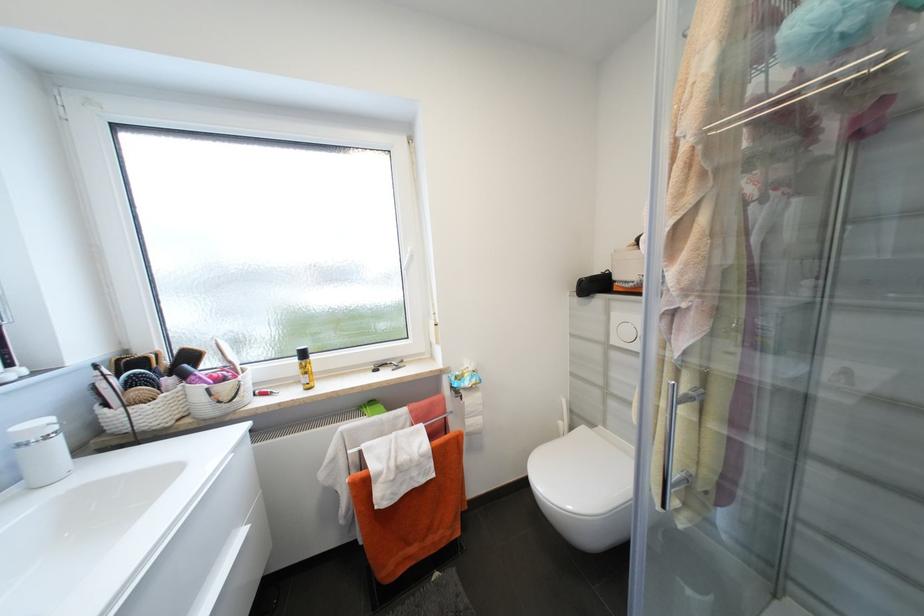
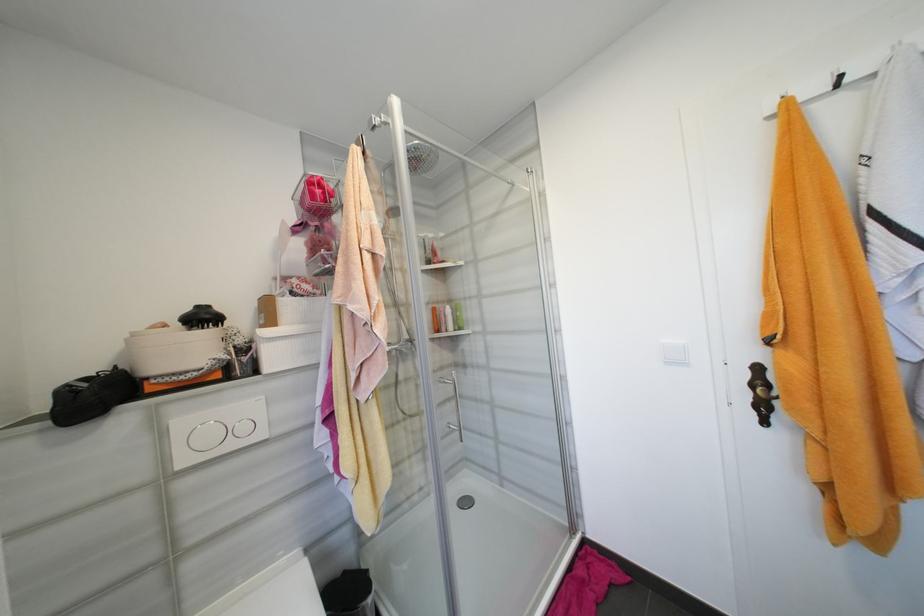
Question: How did the camera likely rotate?

Choices:
 (A) Left
 (B) Right
 (C) Up
 (D) Down

Answer: (B)